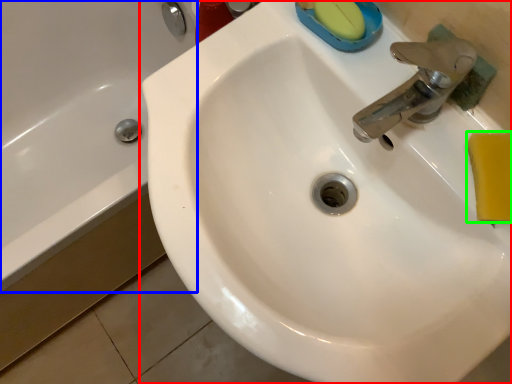
Question: Which object is the closest to the sink (highlighted by a red box)? Choose among these: bath (highlighted by a blue box) or soap (highlighted by a green box).

Choices:
 (A) bath
 (B) soap

Answer: (B)